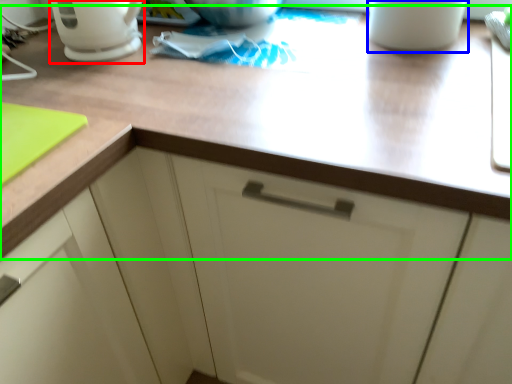
Question: Which is farther away from coffeepot (highlighted by a red box)? mug (highlighted by a blue box) or countertop (highlighted by a green box)?

Choices:
 (A) mug
 (B) countertop

Answer: (A)